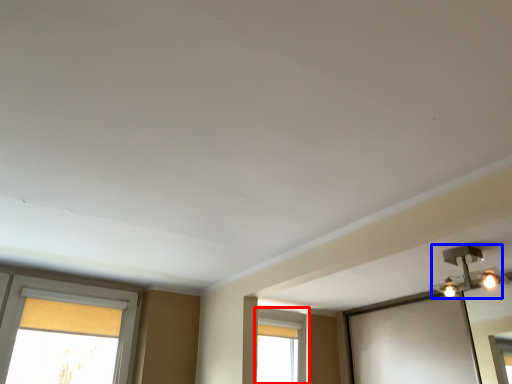
Question: Which point is further to the camera, window (highlighted by a red box) or light fixture (highlighted by a blue box)?

Choices:
 (A) window
 (B) light fixture

Answer: (A)